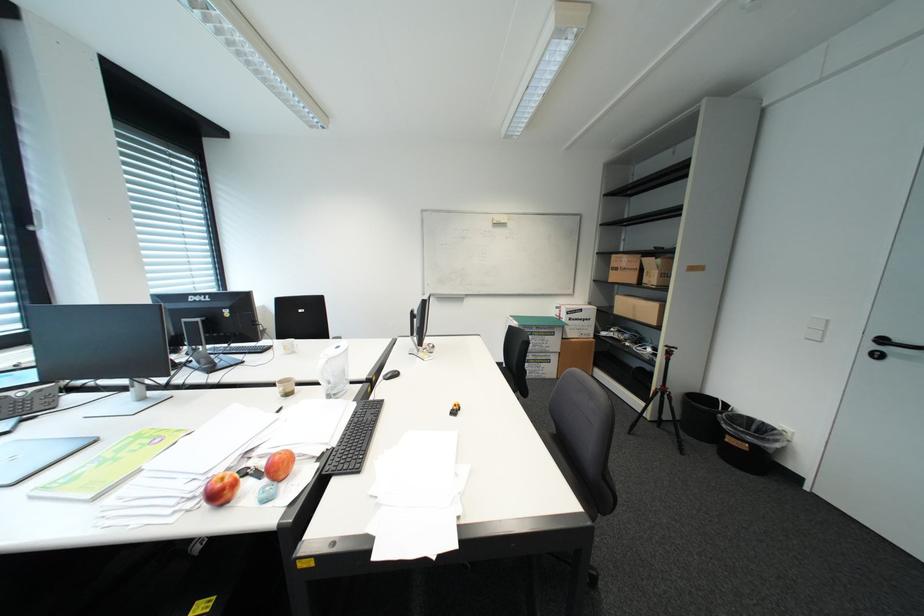
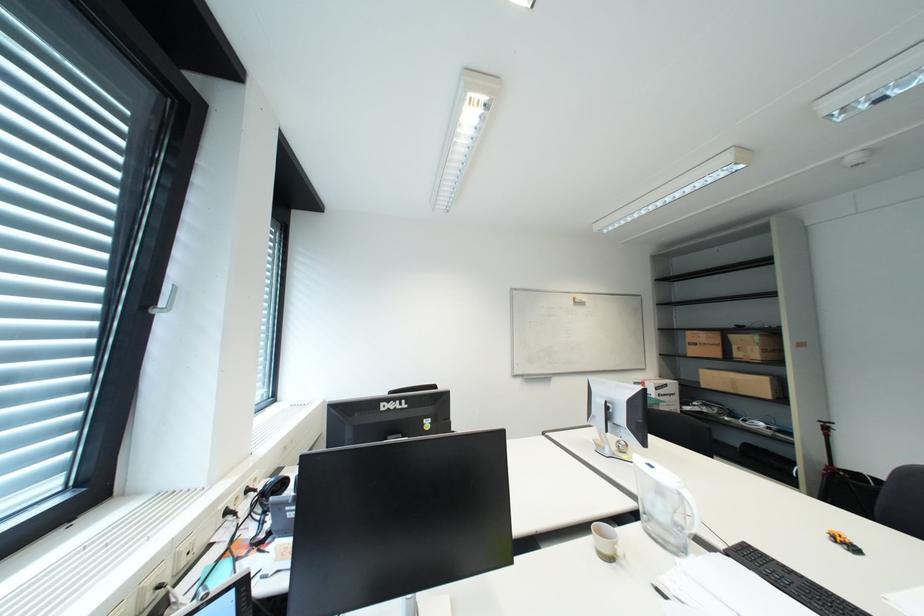
Question: Which direction would the cameraman need to move to produce the second image? Reply with the corresponding letter.

Choices:
 (A) Left
 (B) Right
 (C) Forward
 (D) Backward

Answer: (A)